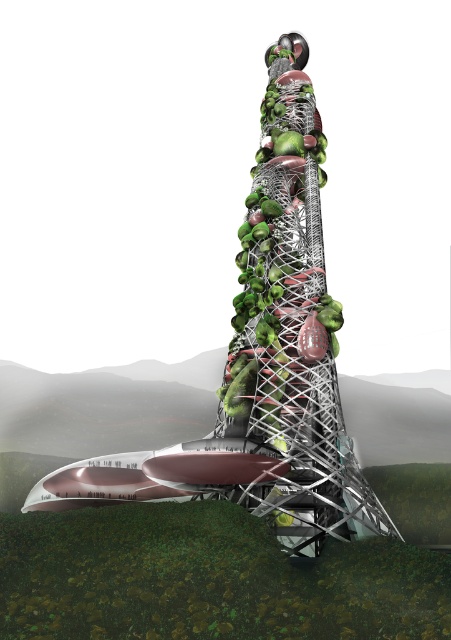
Question: Is brushed metal boat at center smaller than metallic greenery at center?

Choices:
 (A) no
 (B) yes

Answer: (A)

Question: Can you confirm if brushed metal boat at center is smaller than metallic greenery at center?

Choices:
 (A) yes
 (B) no

Answer: (B)

Question: Can you confirm if brushed metal boat at center is thinner than metallic greenery at center?

Choices:
 (A) no
 (B) yes

Answer: (A)